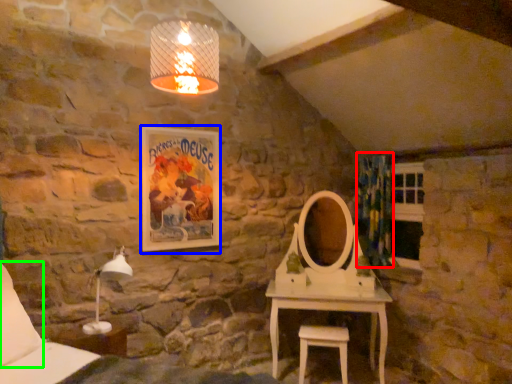
Question: Estimate the real-world distances between objects in this image. Which object is closer to curtain (highlighted by a red box), picture frame (highlighted by a blue box) or pillow (highlighted by a green box)?

Choices:
 (A) picture frame
 (B) pillow

Answer: (A)